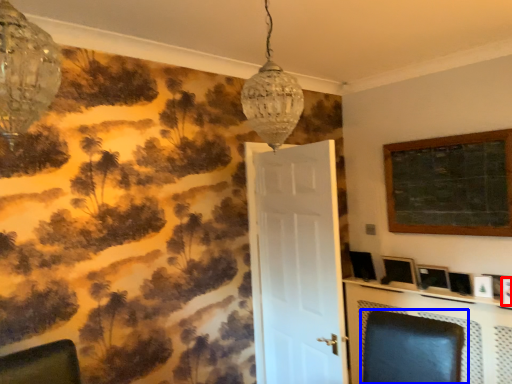
Question: Which object is further to the camera taking this photo, picture frame (highlighted by a red box) or swivel chair (highlighted by a blue box)?

Choices:
 (A) picture frame
 (B) swivel chair

Answer: (A)